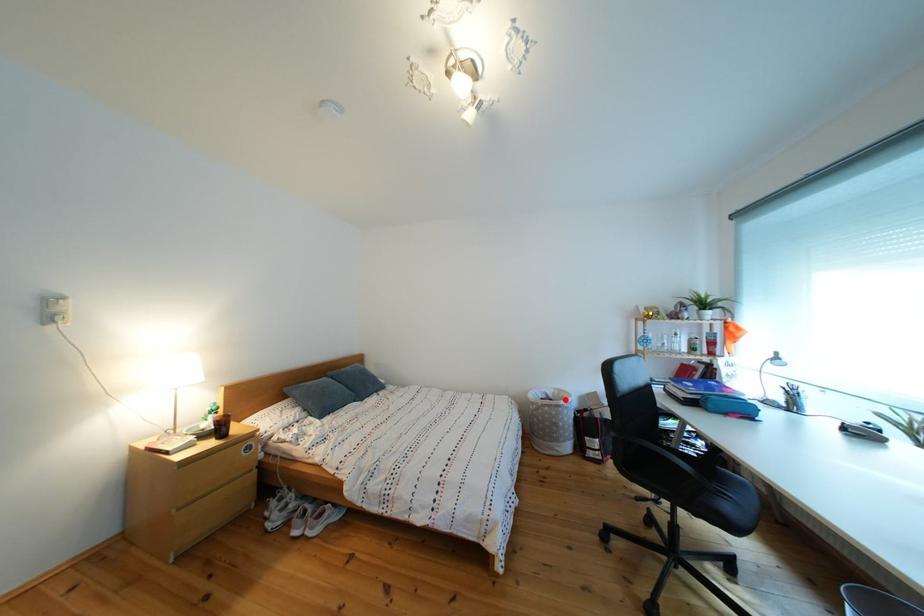
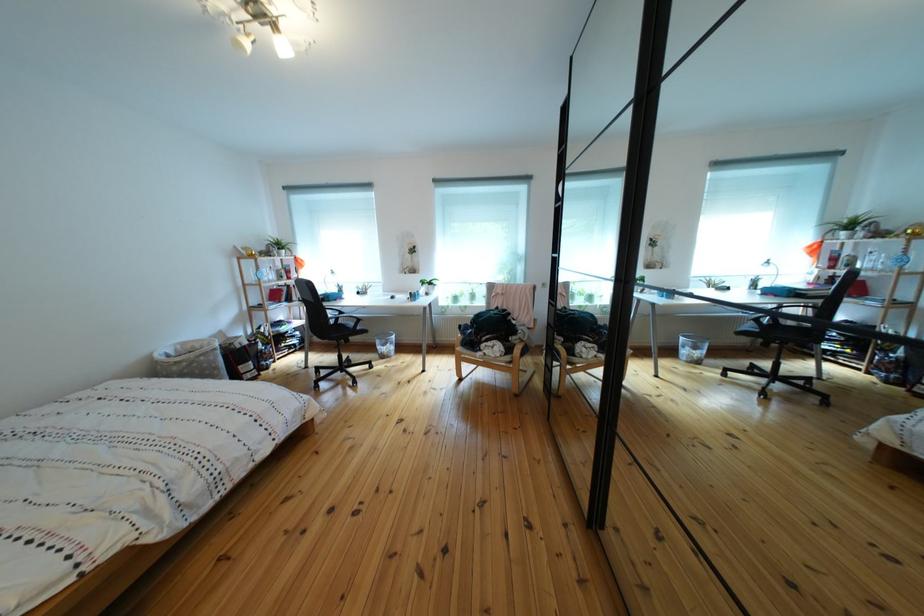
The point at the highlighted location is marked in the first image. Where is the corresponding point in the second image?

(187, 355)